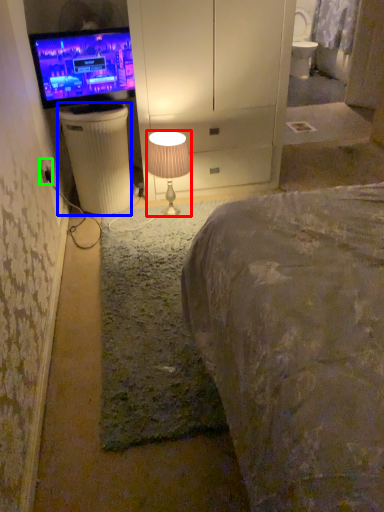
Question: Which is farther away from lamp (highlighted by a red box)? trash bin/can (highlighted by a blue box) or electric outlet (highlighted by a green box)?

Choices:
 (A) trash bin/can
 (B) electric outlet

Answer: (B)